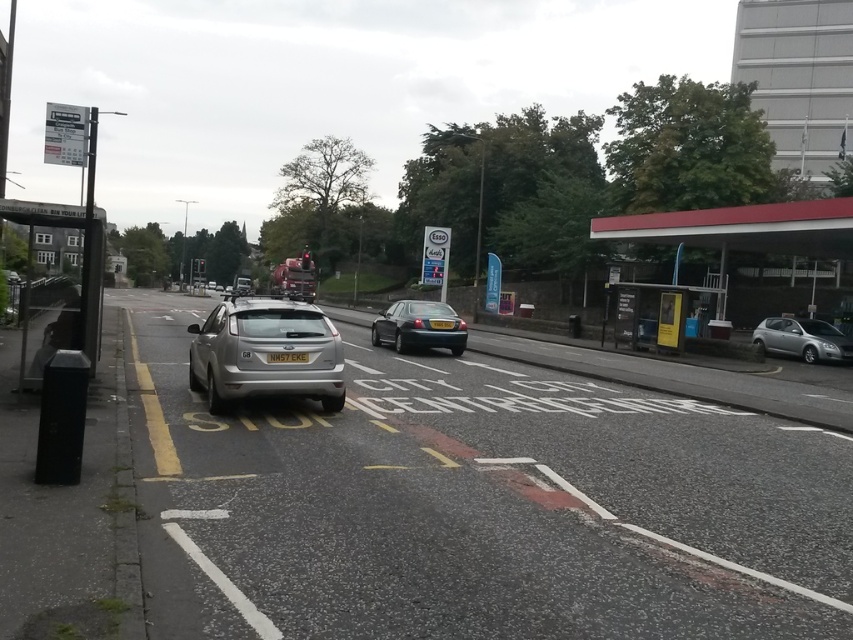
Is metallic blue sedan at center bigger than yellow matte license plate at center?

Yes.

Locate an element on the screen. metallic blue sedan at center is located at coordinates (418, 326).

Locate an element on the screen. This screenshot has width=853, height=640. metallic blue sedan at center is located at coordinates (418, 326).

Locate an element on the screen. The image size is (853, 640). metallic blue sedan at center is located at coordinates point(418,326).

Which of these two, metallic blue sedan at center or yellow plastic license plate at center, stands taller?

With more height is metallic blue sedan at center.

Is metallic blue sedan at center wider than yellow plastic license plate at center?

A: Yes.

Which is behind, point (428, 308) or point (439, 323)?

The point (428, 308) is more distant.

In order to click on metallic blue sedan at center in this screenshot , I will do `click(418, 326)`.

Between silver metallic car at center and metallic blue sedan at center, which one appears on the left side from the viewer's perspective?

metallic blue sedan at center is more to the left.

Does silver metallic car at center have a greater width compared to metallic blue sedan at center?

Correct, the width of silver metallic car at center exceeds that of metallic blue sedan at center.

Describe the element at coordinates (482, 506) in the screenshot. I see `silver metallic car at center` at that location.

At what (x,y) coordinates should I click in order to perform the action: click on silver metallic car at center. Please return your answer as a coordinate pair (x, y). The height and width of the screenshot is (640, 853). Looking at the image, I should click on (482, 506).